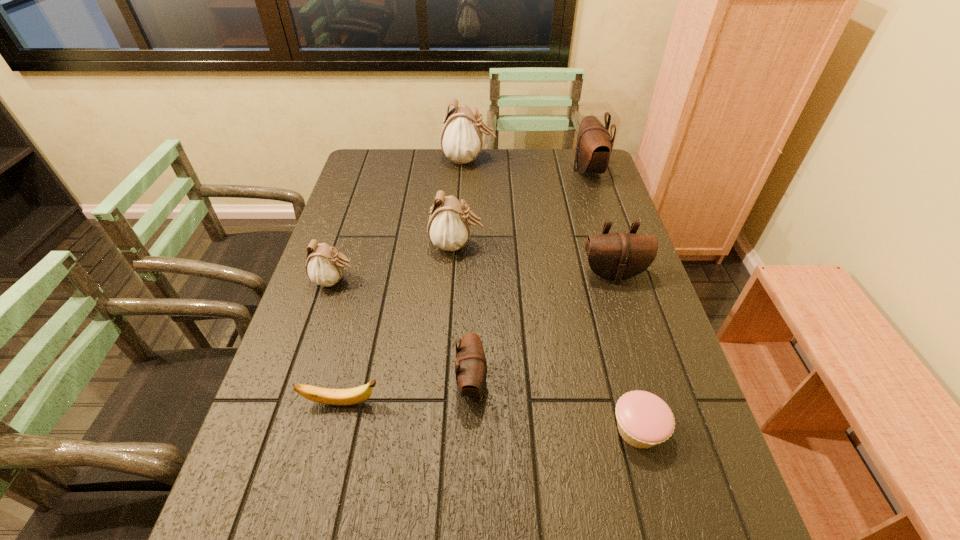
I want to click on yellow banana, so click(x=351, y=396).

Where is `the shortest object`? This screenshot has width=960, height=540. the shortest object is located at coordinates (644, 420).

This screenshot has width=960, height=540. Identify the location of pink cupcake. (644, 420).

Locate an element on the screen. This screenshot has width=960, height=540. free space located on the front-facing side of the biggest white pouch is located at coordinates (588, 160).

The height and width of the screenshot is (540, 960). Find the location of `free region located with the flap open on the farthest brown pouch`. free region located with the flap open on the farthest brown pouch is located at coordinates (471, 171).

Identify the location of vacant space located with the flap open on the farthest brown pouch. (498, 171).

The height and width of the screenshot is (540, 960). In order to click on free space located 0.200m with the flap open on the farthest brown pouch in this screenshot , I will do `click(517, 171)`.

Where is `free point located 0.100m on the front-facing side of the sixth nearest object`? Image resolution: width=960 pixels, height=540 pixels. free point located 0.100m on the front-facing side of the sixth nearest object is located at coordinates click(516, 245).

Find the location of `vacant region located 0.240m with the flap open on the second nearest brown pouch`. vacant region located 0.240m with the flap open on the second nearest brown pouch is located at coordinates (639, 360).

I want to click on free space located on the front-facing side of the nearest white pouch, so click(419, 281).